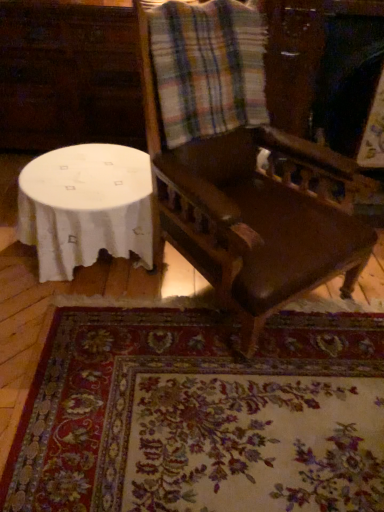
Where is `free space above floral carpet at lower center (from a real-world perspective)`? free space above floral carpet at lower center (from a real-world perspective) is located at coordinates (269, 398).